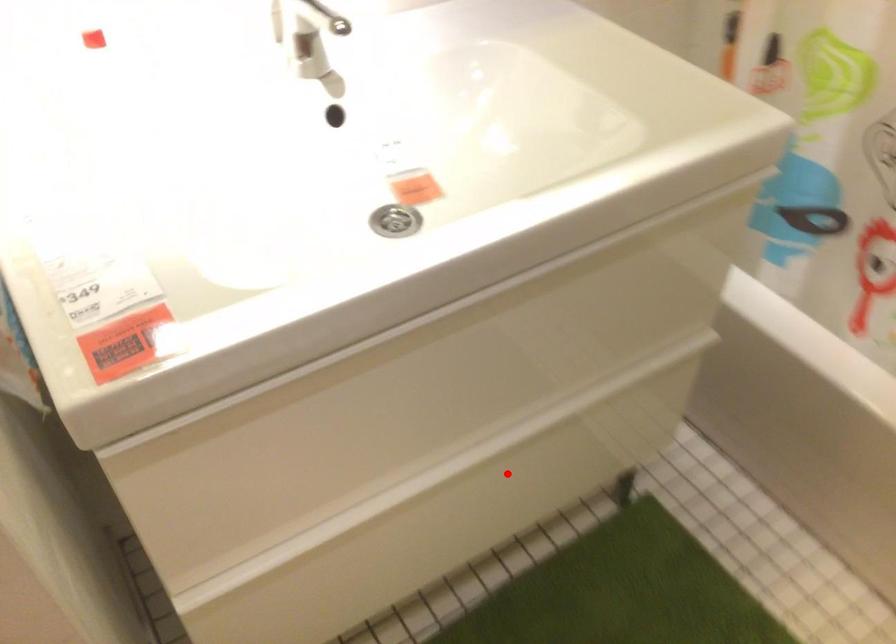
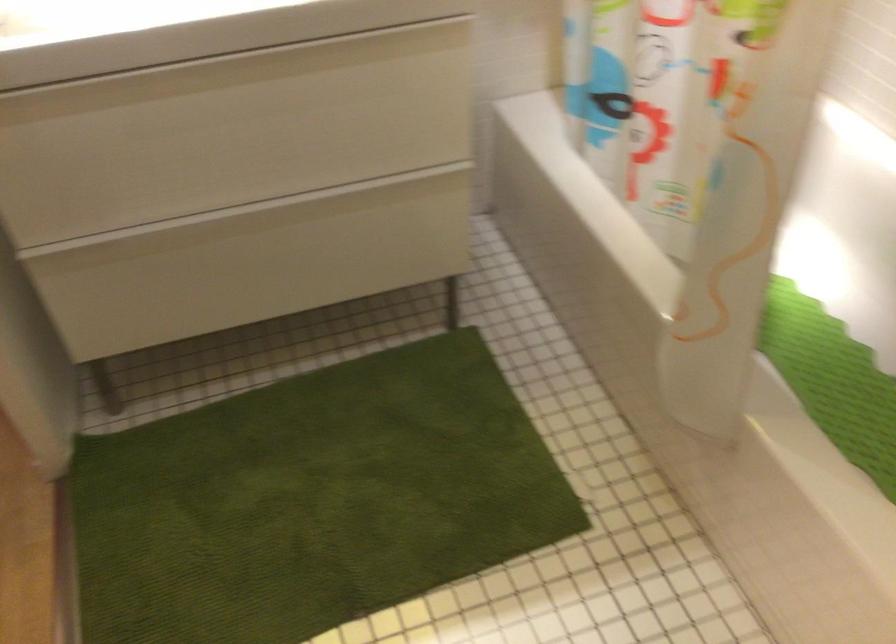
In the second image, find the point that corresponds to the highlighted location in the first image.

(289, 238)